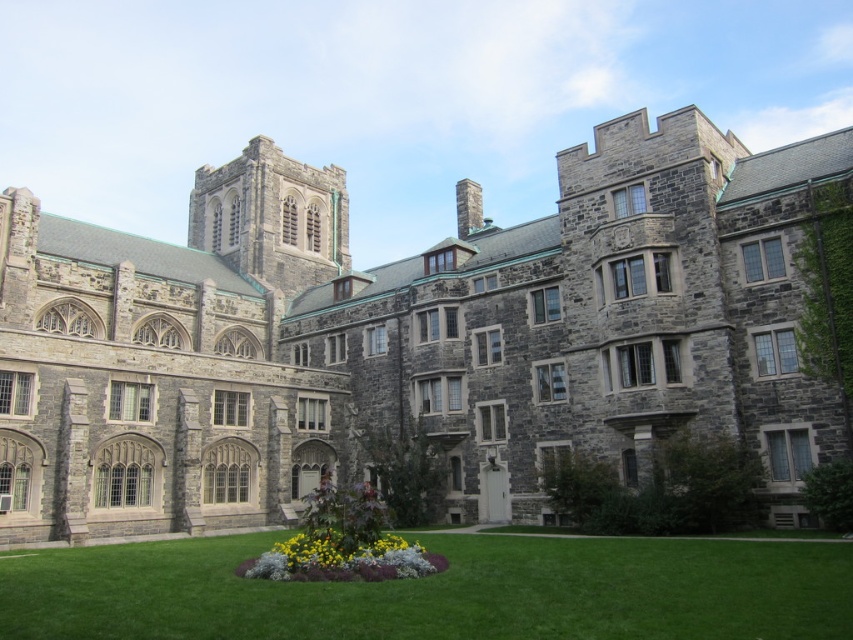
You are standing on the green grass at lower center and want to reach the yellow matte flowers at center. Which direction should you move to get closer to the flowers?

You should move downward because the green grass at lower center is above the yellow matte flowers at center, so moving downward will bring you closer to the flowers.

You are a gardener planning to mow the lawn. You have a lawnmower that can only handle areas larger than the yellow matte flowers at center. Will the green grass at lower center be suitable for mowing with your lawnmower?

The green grass at lower center has a larger size compared to the yellow matte flowers at center, so yes, the lawnmower can handle the green grass at lower center since it is larger than the yellow matte flowers at center.